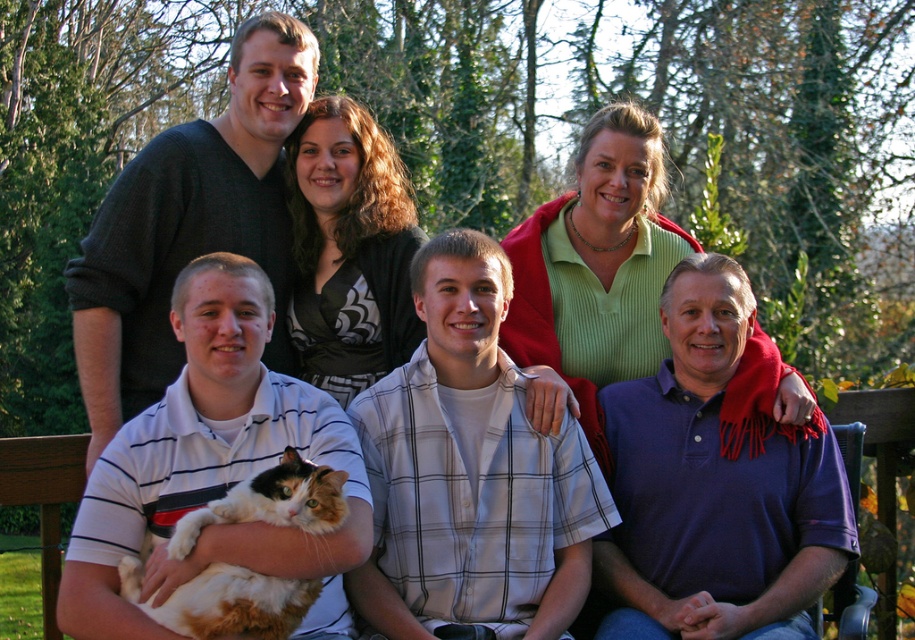
You are a photographer trying to capture a closeup of the calico fur cat at lower left and calico fur cat at center. Which cat should you zoom in on to ensure the cat takes up more of the frame?

The calico fur cat at lower left is larger in size compared to calico fur cat at center, so zooming in on the calico fur cat at lower left will make it take up more of the frame.

You are a photographer trying to capture the calico fur cat at lower left and the calico fur cat at center in a portrait. Which cat should you focus on first if you want to ensure both are in focus, considering their sizes?

The calico fur cat at lower left has a greater height compared to calico fur cat at center. Therefore, focusing on the calico fur cat at lower left first will help ensure both are in focus since it is larger and requires more attention to detail.